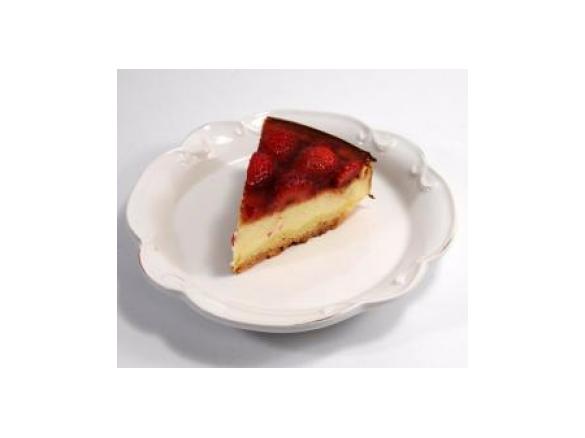
Image resolution: width=585 pixels, height=438 pixels. In order to click on plate in this screenshot , I will do point(419,182), point(356,267), point(252,289), point(149,193), point(208,157), point(385,144), point(195,264).